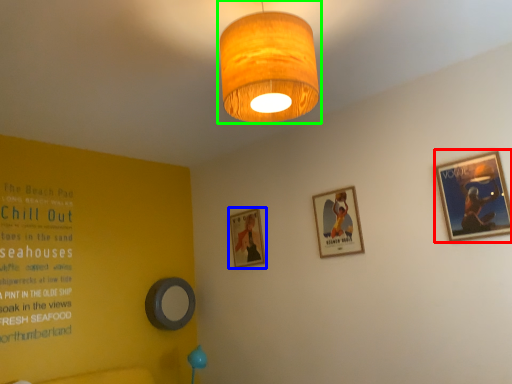
Question: Considering the real-world distances, which object is closest to picture frame (highlighted by a red box)? picture frame (highlighted by a blue box) or lamp (highlighted by a green box).

Choices:
 (A) picture frame
 (B) lamp

Answer: (B)